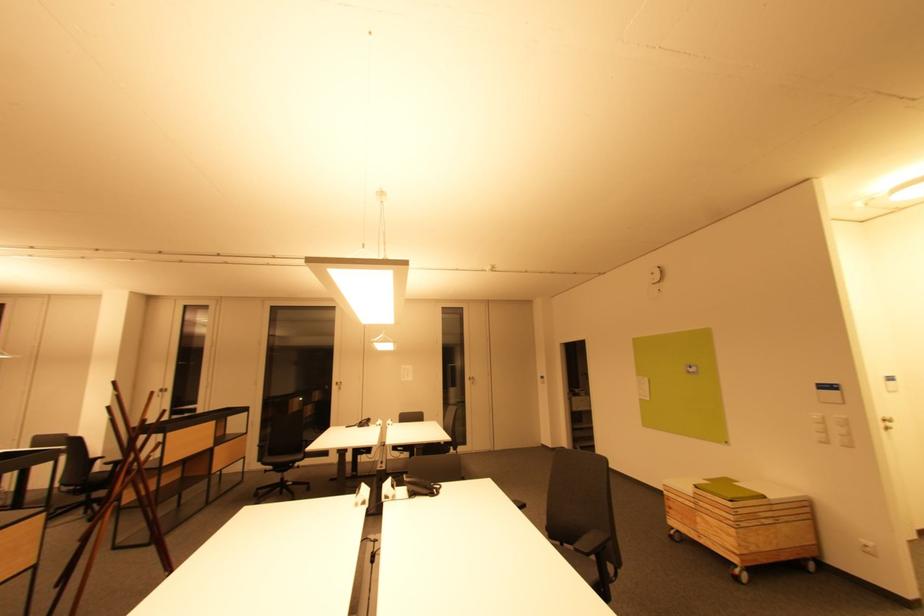
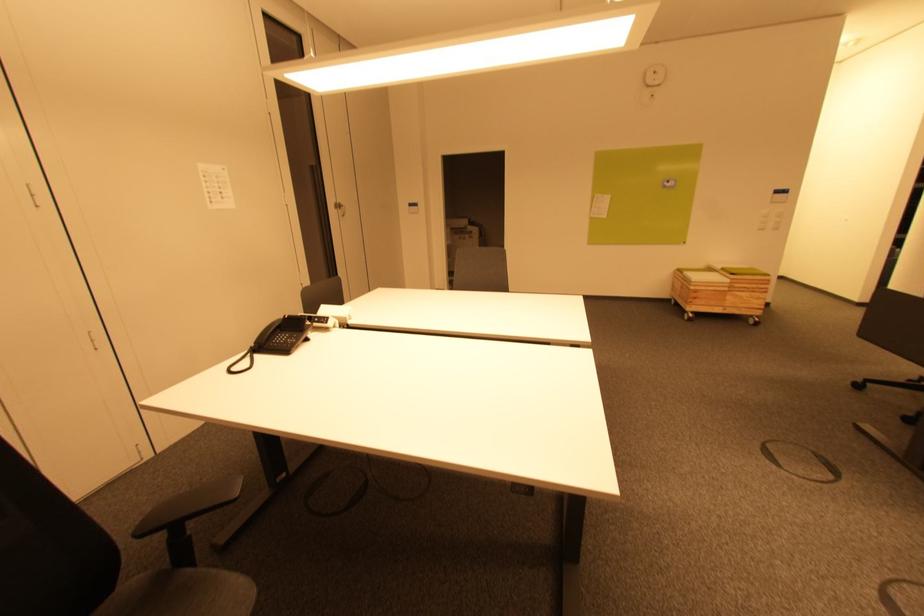
Locate, in the second image, the point that corresponds to point (725, 532) in the first image.

(756, 300)